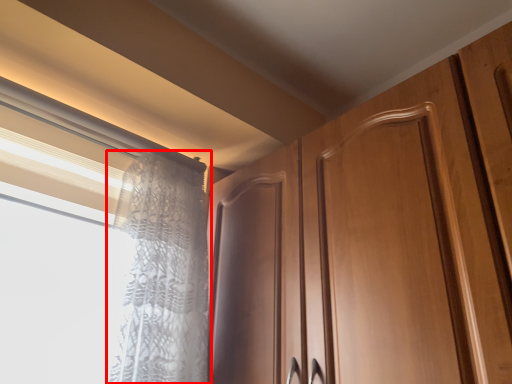
Question: Where is curtain (annotated by the red box) located in relation to window in the image?

Choices:
 (A) left
 (B) right

Answer: (B)